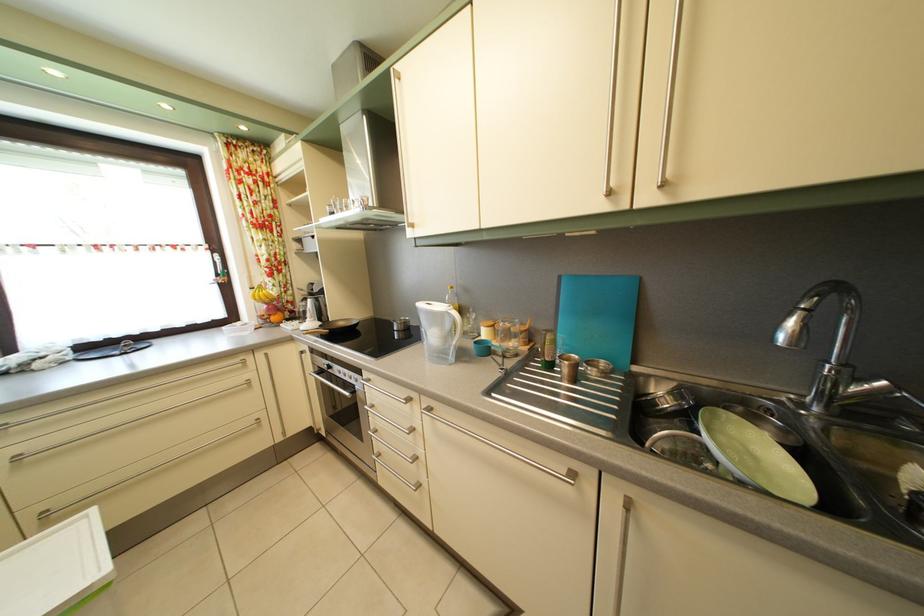
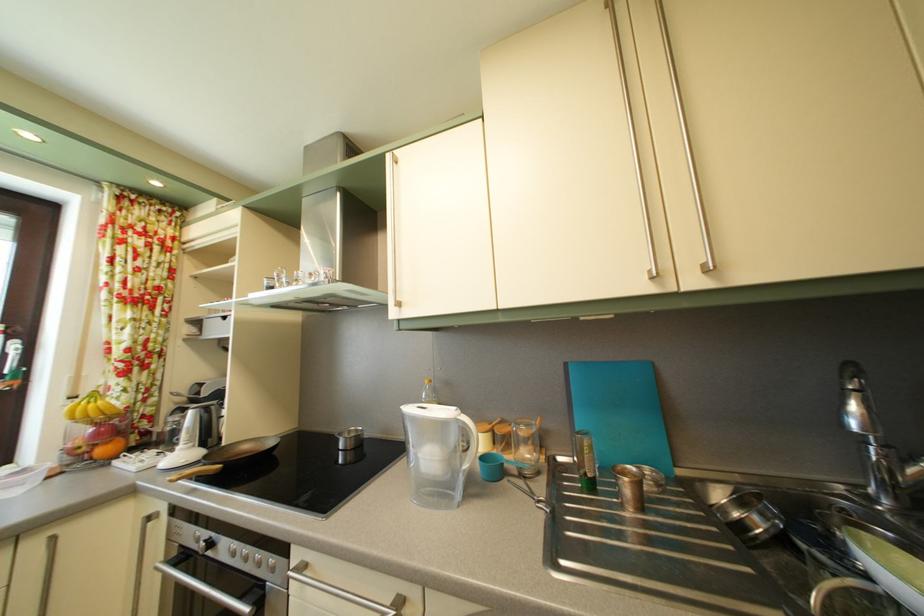
In the scene shown: In a continuous first-person perspective shot, in which direction is the camera moving?

The movement direction of the cameraman is left, forward.